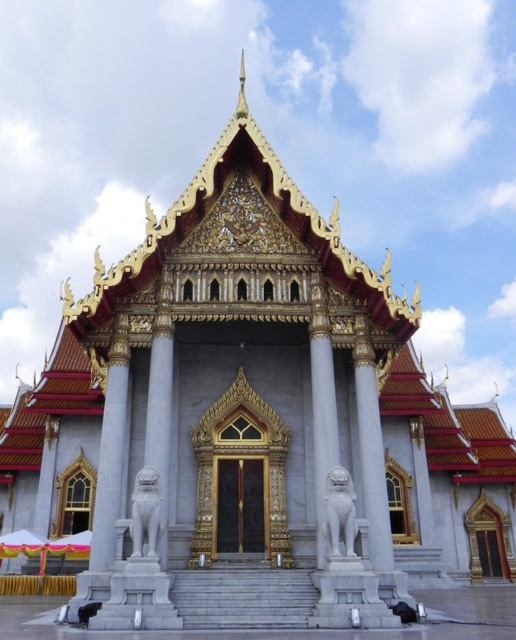
You are an art student analyzing the temple structure. You observe the white marble lion at center and the white marble lion at lower center. Which lion statue appears smaller in size?

The white marble lion at center appears smaller in size because it occupies less space than the white marble lion at lower center.

You are standing at the entrance of the temple and want to take a photo of the white marble lion at center. According to the temple layout, where should you position yourself to capture the lion in the frame?

The white marble lion at center is located at point (322, 419), so you should position yourself at the entrance facing towards the center of the temple to capture it in the frame.

You are a tourist standing at the base of the temple steps. You notice two white marble lions. One is labeled as the white marble lion at center and the other as the white marble lion at lower center. Which lion is closer to you?

The white marble lion at lower center is closer to you because it is positioned above the white marble lion at center, meaning it is nearer in the visual hierarchy from your perspective at the base of the steps.